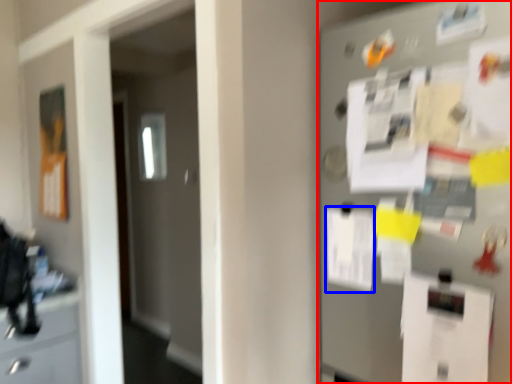
Question: Among these objects, which one is farthest to the camera, fridge (highlighted by a red box) or paper (highlighted by a blue box)?

Choices:
 (A) fridge
 (B) paper

Answer: (B)